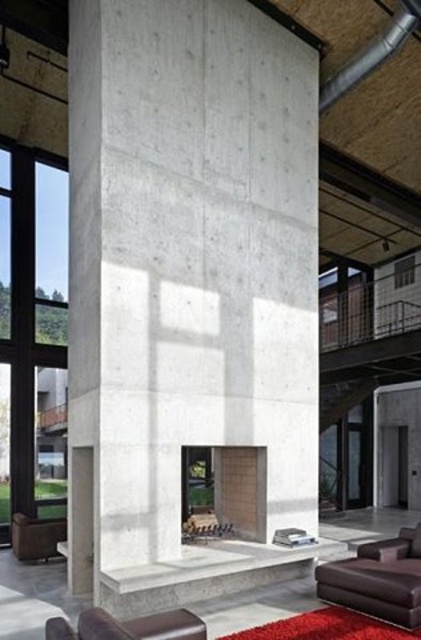
Is point (26, 548) closer to camera compared to point (410, 276)?

Yes, point (26, 548) is closer to viewer.

Who is higher up, brown leather armchair at lower left or clear glass window at upper center?

Positioned higher is clear glass window at upper center.

Between point (55, 548) and point (394, 282), which one is positioned behind?

Positioned behind is point (394, 282).

Identify the location of brown leather armchair at lower left. The image size is (421, 640). (36, 536).

In the scene shown: Can you confirm if transparent glass window at left is positioned below brown leather armchair at lower left?

Actually, transparent glass window at left is above brown leather armchair at lower left.

Can you confirm if transparent glass window at left is bigger than brown leather armchair at lower left?

Correct, transparent glass window at left is larger in size than brown leather armchair at lower left.

Which is behind, point (0, 204) or point (13, 522)?

Point (0, 204)

Image resolution: width=421 pixels, height=640 pixels. Identify the location of transparent glass window at left. (32, 333).

Is point (352, 566) more distant than point (23, 516)?

No, (352, 566) is closer to viewer.

Does leather couch at lower right come in front of brown leather armchair at lower left?

Yes, leather couch at lower right is in front of brown leather armchair at lower left.

Who is more forward, (x=375, y=609) or (x=37, y=554)?

Point (x=375, y=609) is in front.

This screenshot has width=421, height=640. I want to click on leather couch at lower right, so click(378, 579).